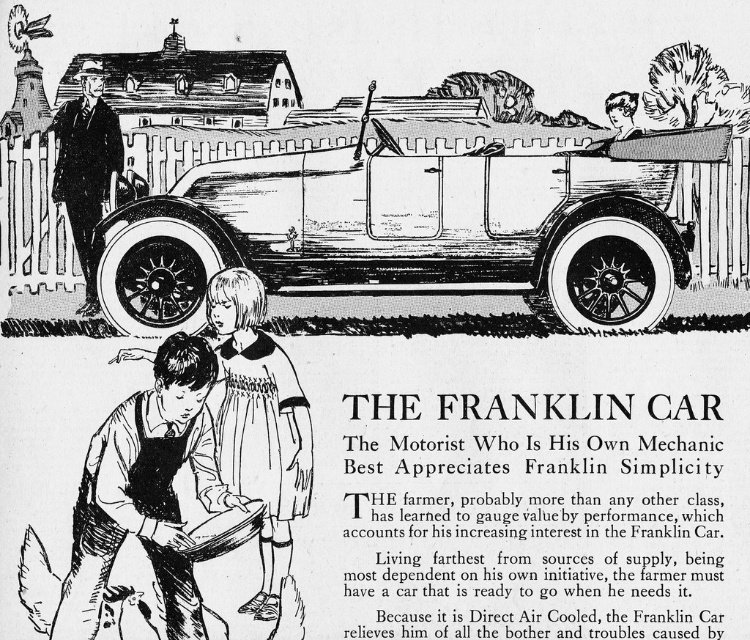
Does silver metallic car at center appear on the left side of smooth black suit at left?

In fact, silver metallic car at center is to the right of smooth black suit at left.

What do you see at coordinates (416, 228) in the screenshot? I see `silver metallic car at center` at bounding box center [416, 228].

Locate an element on the screen. The width and height of the screenshot is (750, 640). silver metallic car at center is located at coordinates (416, 228).

You are a GUI agent. You are given a task and a screenshot of the screen. Output one action in this format:
    pyautogui.click(x=<x>, y=<y>)
    Task: Click on the silver metallic car at center
    This screenshot has width=750, height=640.
    Given the screenshot: What is the action you would take?
    pyautogui.click(x=416, y=228)

Can you confirm if smooth black shirt at lower left is wider than smooth black suit at left?

Indeed, smooth black shirt at lower left has a greater width compared to smooth black suit at left.

This screenshot has width=750, height=640. Find the location of `smooth black shirt at lower left`. smooth black shirt at lower left is located at coordinates (258, 424).

Describe the element at coordinates (147, 492) in the screenshot. Image resolution: width=750 pixels, height=640 pixels. I see `dark brown leather vest at lower left` at that location.

Is point (212, 448) closer to camera compared to point (300, 483)?

No.

The width and height of the screenshot is (750, 640). What are the coordinates of `dark brown leather vest at lower left` in the screenshot? It's located at pos(147,492).